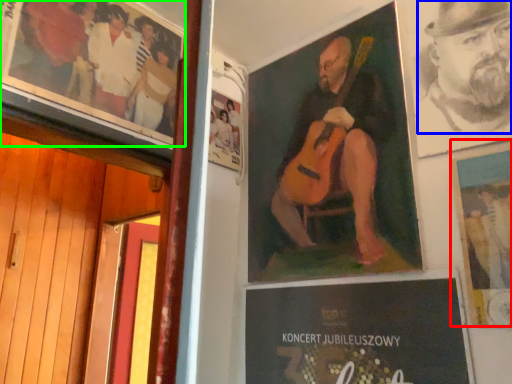
Question: Based on their relative distances, which object is farther from poster (highlighted by a red box)? Choose from person (highlighted by a blue box) and poster (highlighted by a green box).

Choices:
 (A) person
 (B) poster

Answer: (B)